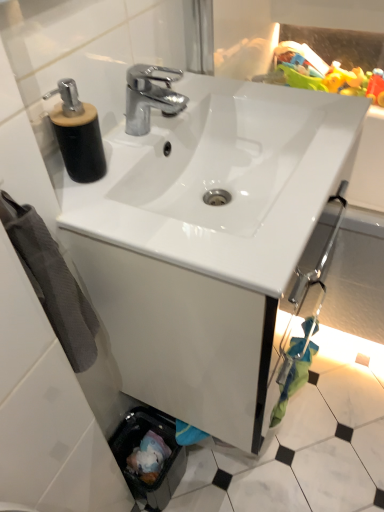
Describe the element at coordinates (321, 74) in the screenshot. The width and height of the screenshot is (384, 512). I see `plastic green toy at upper right` at that location.

What do you see at coordinates (77, 134) in the screenshot? The image size is (384, 512). I see `black matte soap dispenser at upper left` at bounding box center [77, 134].

In order to face white glossy sink at center, should I rotate leftwards or rightwards?

Turn right approximately 3.349 degrees to face it.

Where is `gray cotton towel at left`? gray cotton towel at left is located at coordinates (52, 282).

Consider the image. Could you tell me if plastic green toy at upper right is facing white glossy sink at center?

Yes, plastic green toy at upper right is oriented towards white glossy sink at center.

Locate an element on the screen. This screenshot has height=512, width=384. sink in front of the plastic green toy at upper right is located at coordinates (222, 180).

Is plastic green toy at upper right smaller than white glossy sink at center?

Correct, plastic green toy at upper right occupies less space than white glossy sink at center.

Is plastic green toy at upper right to the right of white glossy sink at center from the viewer's perspective?

Yes, plastic green toy at upper right is to the right of white glossy sink at center.

Would you say gray cotton towel at left is outside black matte soap dispenser at upper left?

Absolutely, gray cotton towel at left is external to black matte soap dispenser at upper left.

How many degrees apart are the facing directions of gray cotton towel at left and black matte soap dispenser at upper left?

The angle between the facing direction of gray cotton towel at left and the facing direction of black matte soap dispenser at upper left is 0.981 degrees.

Is black matte soap dispenser at upper left at the back of gray cotton towel at left?

No, black matte soap dispenser at upper left is not at the back of gray cotton towel at left.

Considering the positions of objects gray cotton towel at left and black matte soap dispenser at upper left in the image provided, who is more to the right, gray cotton towel at left or black matte soap dispenser at upper left?

Positioned to the right is black matte soap dispenser at upper left.

Is point (33, 230) closer to viewer compared to point (307, 115)?

Yes.

Which object is positioned more to the right, gray cotton towel at left or white glossy sink at center?

From the viewer's perspective, white glossy sink at center appears more on the right side.

From the image's perspective, which one is positioned lower, gray cotton towel at left or white glossy sink at center?

gray cotton towel at left appears lower in the image.

Where is `toy that appears behind the black matte soap dispenser at upper left`? This screenshot has width=384, height=512. toy that appears behind the black matte soap dispenser at upper left is located at coordinates (321, 74).

Is black matte soap dispenser at upper left facing towards plastic green toy at upper right?

No, black matte soap dispenser at upper left is not turned towards plastic green toy at upper right.

Which of these two, black matte soap dispenser at upper left or plastic green toy at upper right, is wider?

plastic green toy at upper right.

Which is closer, (x=94, y=106) or (x=282, y=65)?

Point (x=94, y=106).

Is gray cotton towel at left positioned behind plastic green toy at upper right?

No, it is not.

From the image's perspective, is gray cotton towel at left located above plastic green toy at upper right?

Incorrect, from the image's perspective, gray cotton towel at left is lower than plastic green toy at upper right.

Based on the photo, is gray cotton towel at left next to plastic green toy at upper right and touching it?

No, gray cotton towel at left is not touching plastic green toy at upper right.

Would you say gray cotton towel at left contains plastic green toy at upper right?

No, plastic green toy at upper right is not a part of gray cotton towel at left.

How distant is plastic green toy at upper right from gray cotton towel at left?

A distance of 27.75 inches exists between plastic green toy at upper right and gray cotton towel at left.

Consider the image. Relative to gray cotton towel at left, is plastic green toy at upper right in front or behind?

In the image, plastic green toy at upper right appears behind gray cotton towel at left.

Identify the location of toy that appears below the gray cotton towel at left (from a real-world perspective). The width and height of the screenshot is (384, 512). (321, 74).

From a real-world perspective, is plastic green toy at upper right above or below gray cotton towel at left?

plastic green toy at upper right is below gray cotton towel at left.

The height and width of the screenshot is (512, 384). What are the coordinates of `toy behind the black matte soap dispenser at upper left` in the screenshot? It's located at (321, 74).

Is plastic green toy at upper right beside black matte soap dispenser at upper left?

No, plastic green toy at upper right is not in contact with black matte soap dispenser at upper left.

Is the position of plastic green toy at upper right more distant than that of black matte soap dispenser at upper left?

That is True.

Where is `toy behind the white glossy sink at center`? The height and width of the screenshot is (512, 384). toy behind the white glossy sink at center is located at coordinates (321, 74).

Where is `soap dispenser above the gray cotton towel at left (from the image's perspective)`? soap dispenser above the gray cotton towel at left (from the image's perspective) is located at coordinates (77, 134).

Which object lies nearer to the anchor point white glossy sink at center, gray cotton towel at left or plastic green toy at upper right?

Based on the image, plastic green toy at upper right appears to be nearer to white glossy sink at center.

Looking at the image, which one is located closer to black matte soap dispenser at upper left, gray cotton towel at left or white glossy sink at center?

gray cotton towel at left is positioned closer to the anchor black matte soap dispenser at upper left.

From the picture: Which object lies nearer to the anchor point gray cotton towel at left, white glossy sink at center or plastic green toy at upper right?

white glossy sink at center lies closer to gray cotton towel at left than the other object.

When comparing their distances from gray cotton towel at left, does black matte soap dispenser at upper left or plastic green toy at upper right seem closer?

black matte soap dispenser at upper left lies closer to gray cotton towel at left than the other object.

Estimate the real-world distances between objects in this image. Which object is further from gray cotton towel at left, black matte soap dispenser at upper left or white glossy sink at center?

Among the two, white glossy sink at center is located further to gray cotton towel at left.

Which object lies further to the anchor point plastic green toy at upper right, white glossy sink at center or black matte soap dispenser at upper left?

black matte soap dispenser at upper left lies further to plastic green toy at upper right than the other object.

When comparing their distances from black matte soap dispenser at upper left, does white glossy sink at center or gray cotton towel at left seem closer?

gray cotton towel at left is positioned closer to the anchor black matte soap dispenser at upper left.

Based on their spatial positions, is gray cotton towel at left or plastic green toy at upper right further from black matte soap dispenser at upper left?

plastic green toy at upper right.

This screenshot has width=384, height=512. Identify the location of soap dispenser between white glossy sink at center and plastic green toy at upper right in the front-back direction. (77, 134).

You are a GUI agent. You are given a task and a screenshot of the screen. Output one action in this format:
    pyautogui.click(x=<x>, y=<y>)
    Task: Click on the soap dispenser between gray cotton towel at left and plastic green toy at upper right along the z-axis
    This screenshot has width=384, height=512.
    Given the screenshot: What is the action you would take?
    pyautogui.click(x=77, y=134)

Find the location of a particular element. soap dispenser between gray cotton towel at left and white glossy sink at center in the horizontal direction is located at coordinates click(77, 134).

You are a GUI agent. You are given a task and a screenshot of the screen. Output one action in this format:
    pyautogui.click(x=<x>, y=<y>)
    Task: Click on the sink located between gray cotton towel at left and plastic green toy at upper right in the depth direction
    Image resolution: width=384 pixels, height=512 pixels.
    Given the screenshot: What is the action you would take?
    pyautogui.click(x=222, y=180)